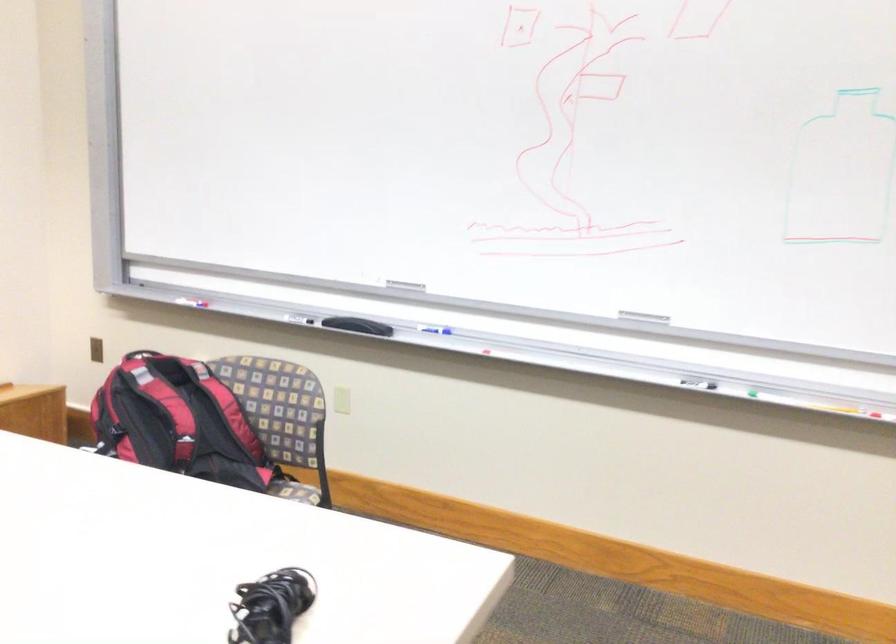
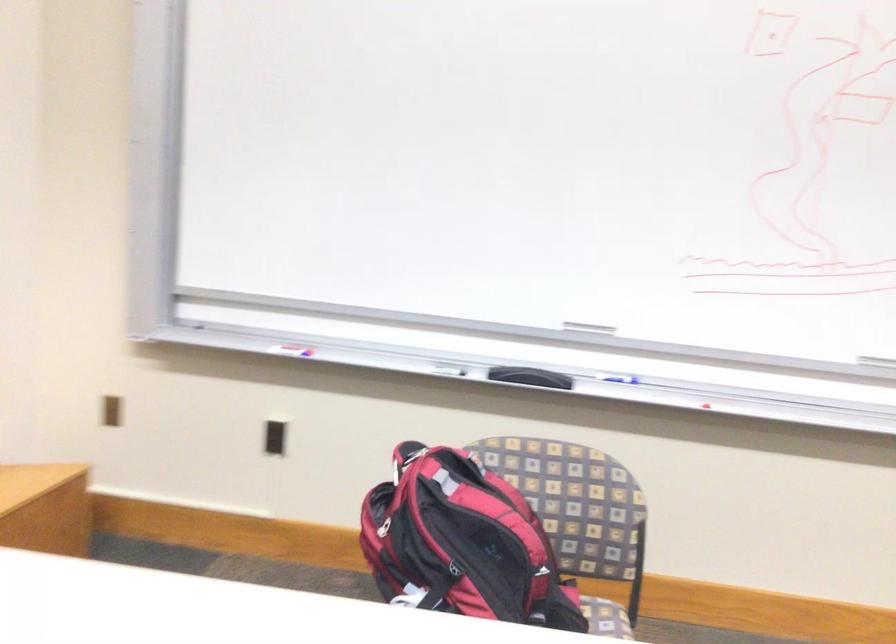
The point at [113,406] is marked in the first image. Where is the corresponding point in the second image?

(383, 527)